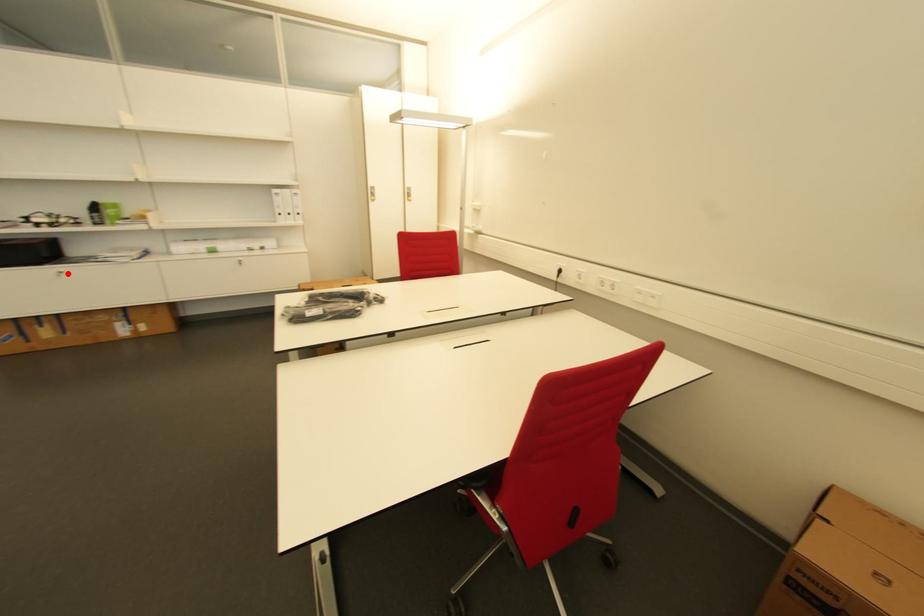
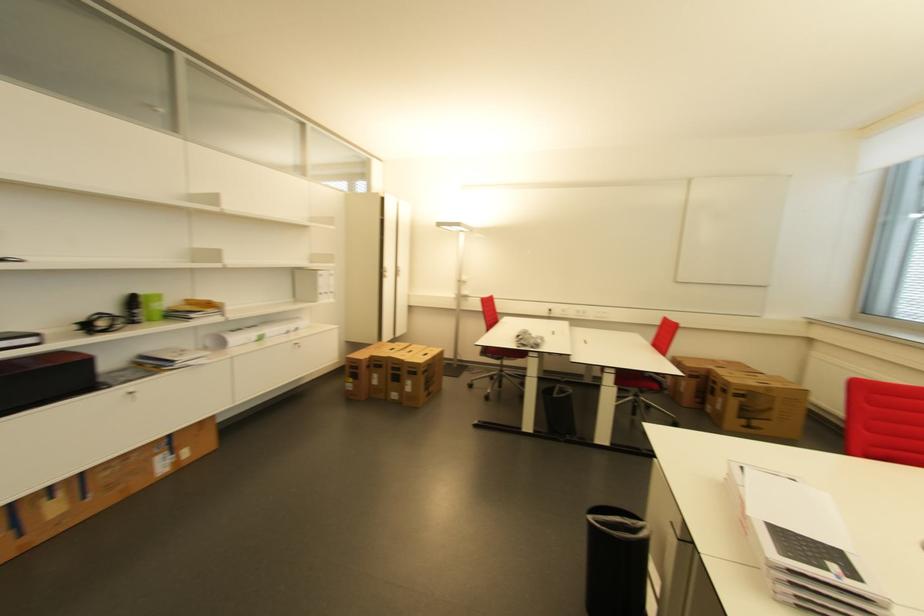
Where in the second image is the point corresponding to the highlighted location from the first image?

(137, 394)